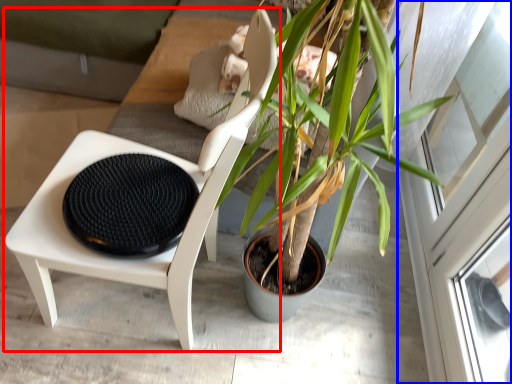
Question: Which of the following is the farthest to the observer, chair (highlighted by a red box) or screen door (highlighted by a blue box)?

Choices:
 (A) chair
 (B) screen door

Answer: (B)